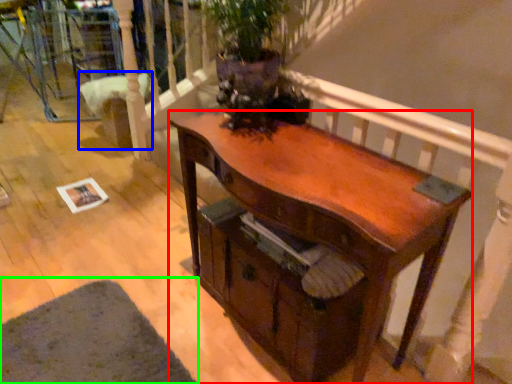
Question: Which is farther away from desk (highlighted by a red box)? armchair (highlighted by a blue box) or mat (highlighted by a green box)?

Choices:
 (A) armchair
 (B) mat

Answer: (A)